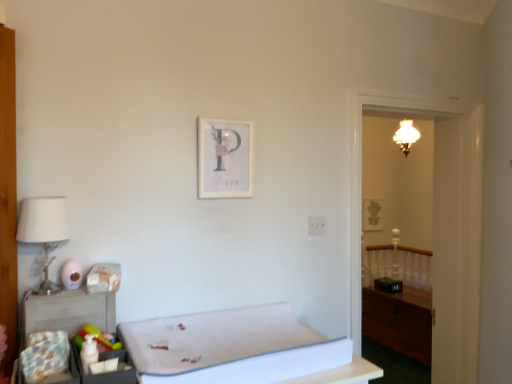
Question: Is white foam mattress at lower center not inside wooden armoire at left?

Choices:
 (A) no
 (B) yes

Answer: (B)

Question: From a real-world perspective, is white foam mattress at lower center below wooden armoire at left?

Choices:
 (A) yes
 (B) no

Answer: (A)

Question: From the image's perspective, does white foam mattress at lower center appear higher than wooden armoire at left?

Choices:
 (A) yes
 (B) no

Answer: (B)

Question: Is white foam mattress at lower center smaller than wooden armoire at left?

Choices:
 (A) yes
 (B) no

Answer: (B)

Question: Can you confirm if white foam mattress at lower center is thinner than wooden armoire at left?

Choices:
 (A) no
 (B) yes

Answer: (A)

Question: From the image's perspective, is matte white lampshade at upper right positioned above or below wooden table at lower left?

Choices:
 (A) below
 (B) above

Answer: (B)

Question: In terms of width, does matte white lampshade at upper right look wider or thinner when compared to wooden table at lower left?

Choices:
 (A) thin
 (B) wide

Answer: (B)

Question: In the image, is matte white lampshade at upper right on the left side or the right side of wooden table at lower left?

Choices:
 (A) left
 (B) right

Answer: (B)

Question: Considering the positions of matte white lampshade at upper right and wooden table at lower left in the image, is matte white lampshade at upper right bigger or smaller than wooden table at lower left?

Choices:
 (A) small
 (B) big

Answer: (B)

Question: In the image, is wooden table at lower left positioned in front of or behind wooden picture frame at right, the first picture frame when ordered from back to front?

Choices:
 (A) front
 (B) behind

Answer: (A)

Question: Would you say wooden table at lower left is to the left or to the right of wooden picture frame at right, the first picture frame when ordered from back to front, in the picture?

Choices:
 (A) left
 (B) right

Answer: (A)

Question: Which is correct: wooden table at lower left is inside wooden picture frame at right, marked as the 1th picture frame in a right-to-left arrangement, or outside of it?

Choices:
 (A) inside
 (B) outside

Answer: (B)

Question: From the image's perspective, is wooden table at lower left above or below wooden picture frame at right, marked as the 1th picture frame in a right-to-left arrangement?

Choices:
 (A) below
 (B) above

Answer: (A)

Question: From their relative heights in the image, would you say wooden chest at right is taller or shorter than matte white lampshade at upper right?

Choices:
 (A) tall
 (B) short

Answer: (A)

Question: In the image, is wooden chest at right positioned in front of or behind matte white lampshade at upper right?

Choices:
 (A) behind
 (B) front

Answer: (B)